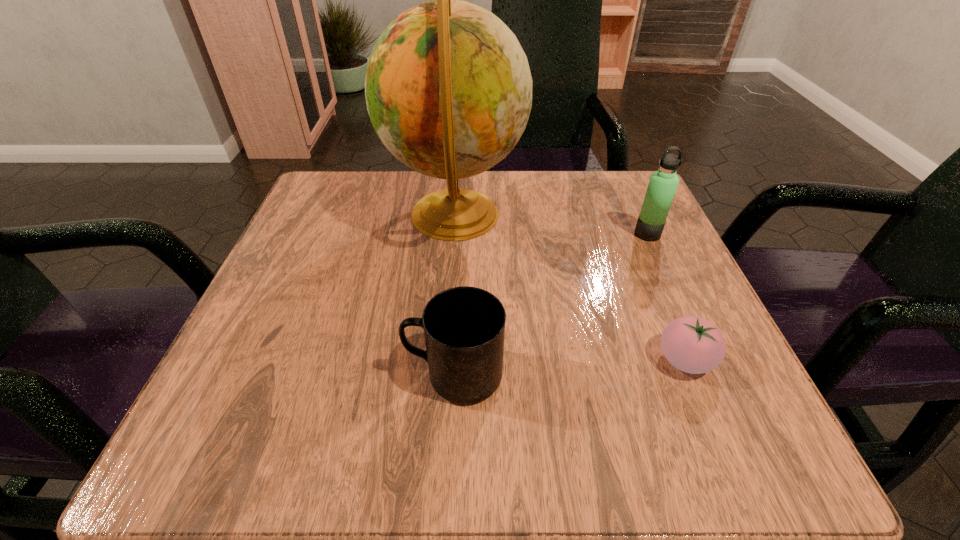
The image size is (960, 540). What are the coordinates of `globe present at the far edge` in the screenshot? It's located at (448, 88).

Where is `thermos bottle positioned at the far edge`? The height and width of the screenshot is (540, 960). thermos bottle positioned at the far edge is located at coordinates (663, 183).

Identify the location of object present at the near edge. Image resolution: width=960 pixels, height=540 pixels. (464, 327).

Find the location of a particular element. The height and width of the screenshot is (540, 960). thermos bottle situated at the right edge is located at coordinates (663, 183).

At what (x,y) coordinates should I click in order to perform the action: click on tomato located at the right edge. Please return your answer as a coordinate pair (x, y). The image size is (960, 540). Looking at the image, I should click on (692, 344).

The width and height of the screenshot is (960, 540). What are the coordinates of `object positioned at the far right corner` in the screenshot? It's located at (663, 183).

Find the location of a particular element. free space at the far edge is located at coordinates pos(428,182).

Image resolution: width=960 pixels, height=540 pixels. In the image, there is a desktop. In order to click on vacant space at the near edge in this screenshot , I will do `click(408, 467)`.

Where is `vacant region at the left edge of the desktop`? Image resolution: width=960 pixels, height=540 pixels. vacant region at the left edge of the desktop is located at coordinates (324, 307).

At what (x,y) coordinates should I click in order to perform the action: click on free space at the right edge of the desktop. Please return your answer as a coordinate pair (x, y). The height and width of the screenshot is (540, 960). Looking at the image, I should click on (621, 310).